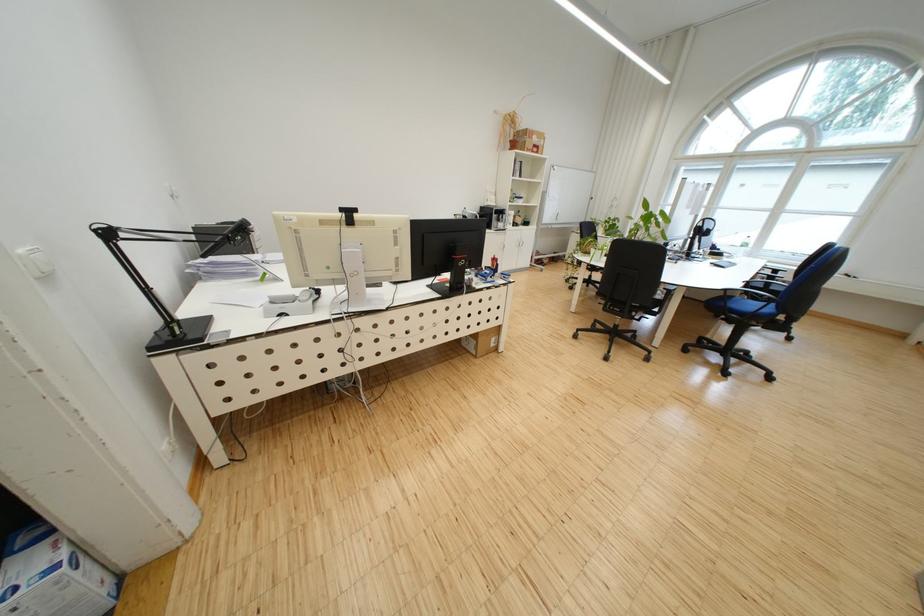
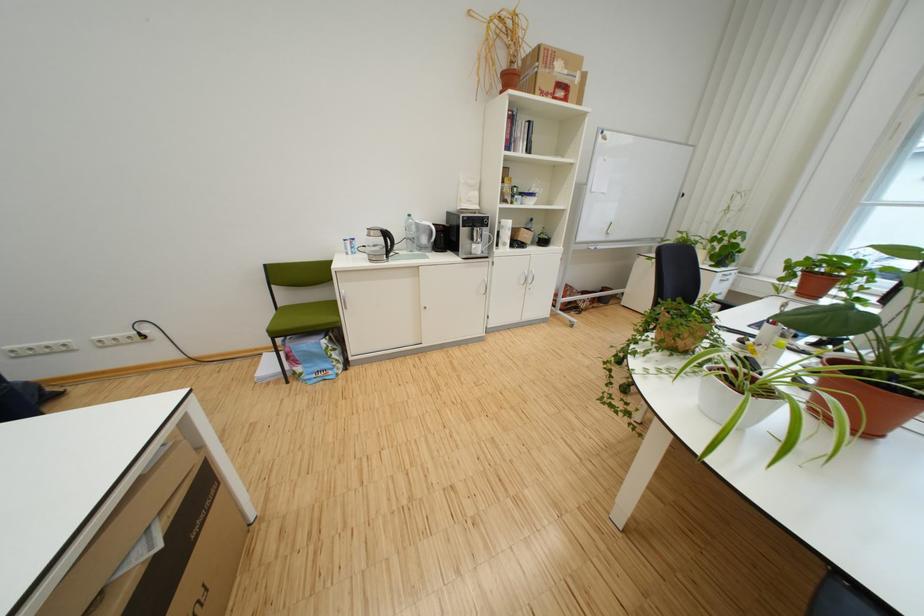
Which direction would the cameraman need to move to produce the second image?

The cameraman walked toward right, forward.